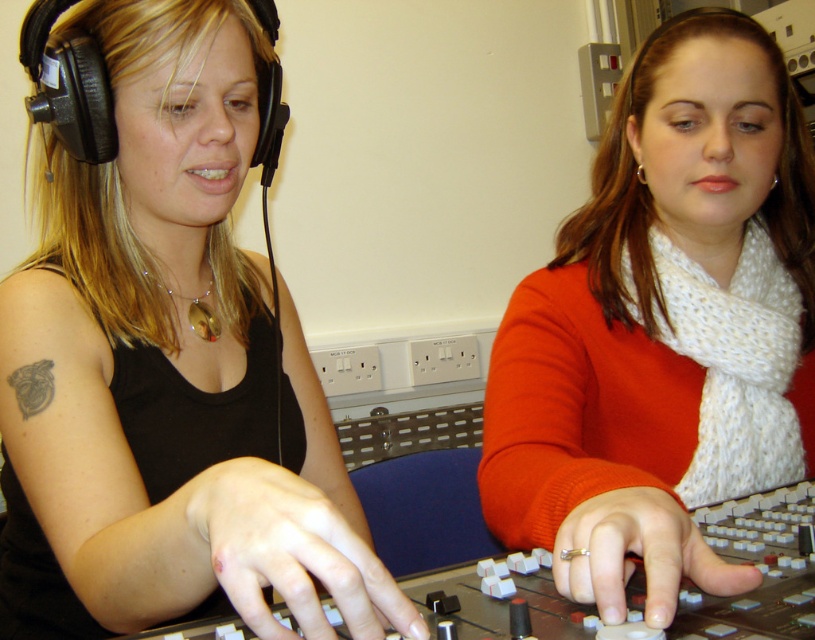
Does matte black headphones at left have a larger size compared to white knitted scarf at center?

Yes, matte black headphones at left is bigger than white knitted scarf at center.

This screenshot has height=640, width=815. What are the coordinates of `matte black headphones at left` in the screenshot? It's located at (170, 362).